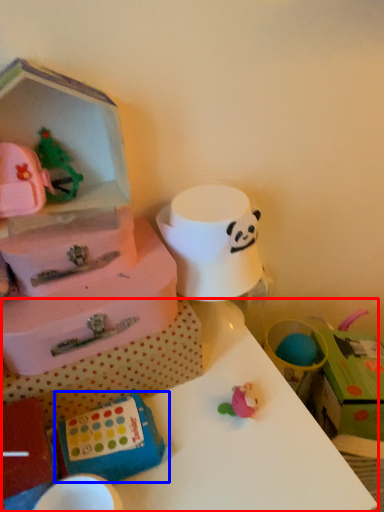
Question: Which of the following is the farthest to the observer, table (highlighted by a red box) or box (highlighted by a blue box)?

Choices:
 (A) table
 (B) box

Answer: (B)